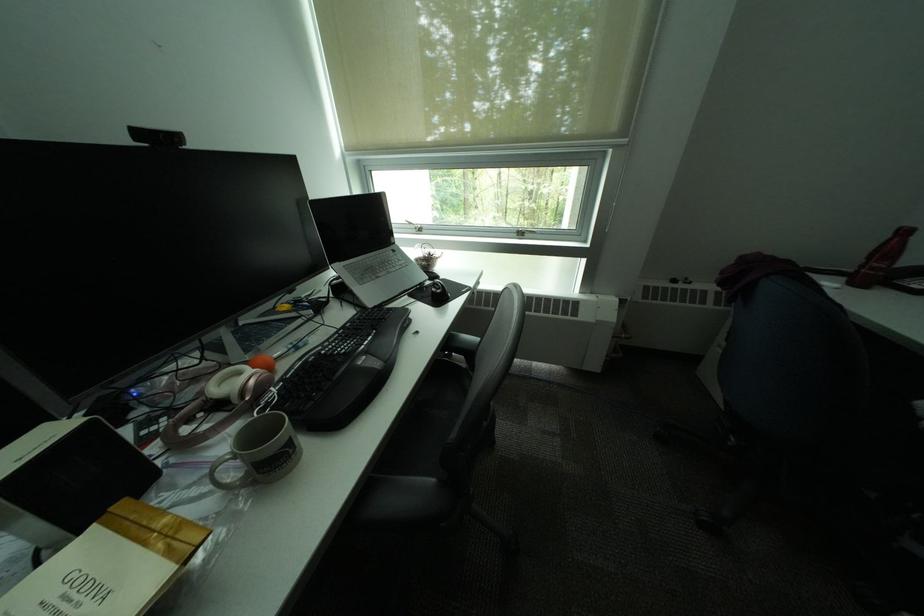
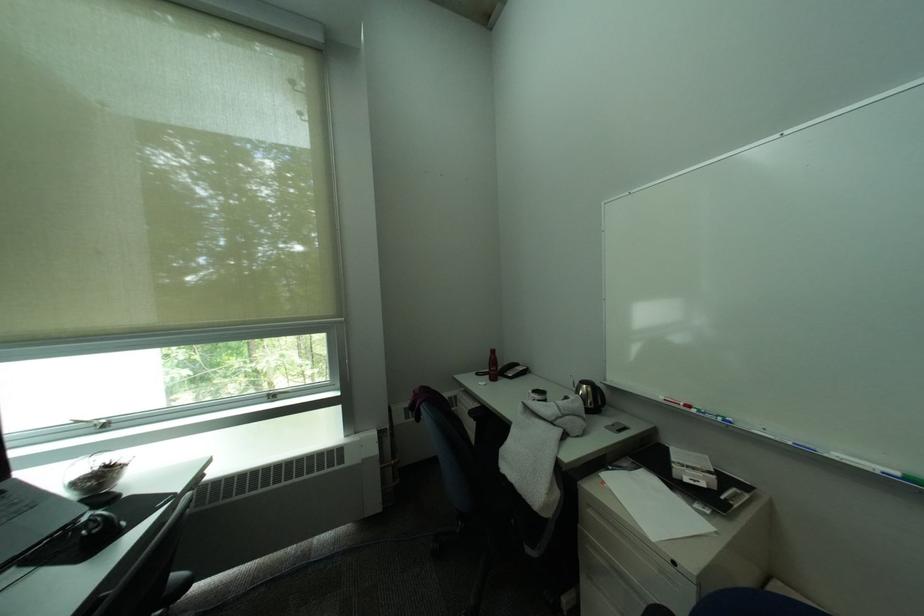
Where in the second image is the point corresponding to pixel 531 231 from the first image?

(283, 392)